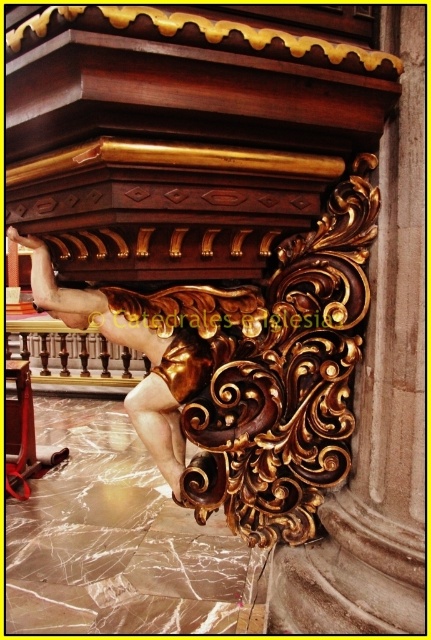
Describe the element at coordinates (274, 371) in the screenshot. The height and width of the screenshot is (640, 431). I see `gold polished wood carving at center` at that location.

In the scene shown: Who is lower down, gold polished wood carving at center or gold polished wood deity at lower center?

Positioned lower is gold polished wood carving at center.

Is point (274, 337) positioned before point (187, 358)?

That is False.

Find the location of `gold polished wood carving at center`. gold polished wood carving at center is located at coordinates (274, 371).